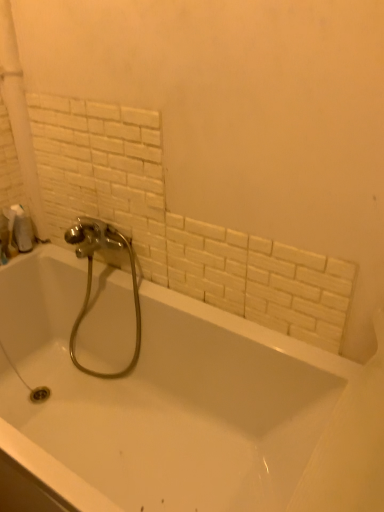
What do you see at coordinates (91, 278) in the screenshot?
I see `chrome metallic faucet at center` at bounding box center [91, 278].

In order to click on white glossy bathtub at center in this screenshot , I will do `click(158, 400)`.

From a real-world perspective, is white matte toilet paper at left located beneath chrome metallic faucet at center?

No, from a real-world perspective, white matte toilet paper at left is not below chrome metallic faucet at center.

How distant is white matte toilet paper at left from chrome metallic faucet at center?

white matte toilet paper at left and chrome metallic faucet at center are 13.01 inches apart.

From the image's perspective, is white matte toilet paper at left beneath chrome metallic faucet at center?

No, from the image's perspective, white matte toilet paper at left is not beneath chrome metallic faucet at center.

Which object is thinner, white matte toilet paper at left or chrome metallic faucet at center?

Thinner between the two is white matte toilet paper at left.

Is white matte toilet paper at left to the left of white glossy bathtub at center from the viewer's perspective?

Indeed, white matte toilet paper at left is positioned on the left side of white glossy bathtub at center.

Is point (21, 232) less distant than point (159, 485)?

No, (21, 232) is further to viewer.

Considering the sizes of objects white matte toilet paper at left and white glossy bathtub at center in the image provided, who is wider, white matte toilet paper at left or white glossy bathtub at center?

white glossy bathtub at center.

From the image's perspective, relative to white glossy bathtub at center, is white matte toilet paper at left above or below?

white matte toilet paper at left is above white glossy bathtub at center.

Is chrome metallic faucet at center positioned with its back to white glossy bathtub at center?

Yes, chrome metallic faucet at center is positioned with its back facing white glossy bathtub at center.

Is chrome metallic faucet at center shorter than white glossy bathtub at center?

In fact, chrome metallic faucet at center may be taller than white glossy bathtub at center.

Which object is positioned more to the left, chrome metallic faucet at center or white glossy bathtub at center?

From the viewer's perspective, chrome metallic faucet at center appears more on the left side.

Considering the sizes of chrome metallic faucet at center and white glossy bathtub at center in the image, is chrome metallic faucet at center bigger or smaller than white glossy bathtub at center?

Considering their sizes, chrome metallic faucet at center takes up less space than white glossy bathtub at center.

Between white glossy bathtub at center and chrome metallic faucet at center, which one is positioned in front?

Positioned in front is white glossy bathtub at center.

Choose the correct answer: Is white glossy bathtub at center inside chrome metallic faucet at center or outside it?

white glossy bathtub at center is spatially situated outside chrome metallic faucet at center.

Identify the location of bathtub in front of the chrome metallic faucet at center. (158, 400).

How many degrees apart are the facing directions of white glossy bathtub at center and chrome metallic faucet at center?

white glossy bathtub at center and chrome metallic faucet at center are facing 0.000261 degrees away from each other.

Are white glossy bathtub at center and white matte toilet paper at left far apart?

white glossy bathtub at center is near white matte toilet paper at left, not far away.

From the image's perspective, is white glossy bathtub at center located beneath white matte toilet paper at left?

Yes, from the image's perspective, white glossy bathtub at center is beneath white matte toilet paper at left.

Does point (220, 374) lie in front of point (15, 234)?

Yes, point (220, 374) is in front of point (15, 234).

Looking at their sizes, would you say chrome metallic faucet at center is wider or thinner than white matte toilet paper at left?

In the image, chrome metallic faucet at center appears to be wider than white matte toilet paper at left.

The image size is (384, 512). I want to click on tap in front of the white matte toilet paper at left, so click(91, 278).

Which is more to the left, chrome metallic faucet at center or white matte toilet paper at left?

From the viewer's perspective, white matte toilet paper at left appears more on the left side.

Identify the location of tap below the white matte toilet paper at left (from the image's perspective). This screenshot has height=512, width=384. (91, 278).

Where is `bathtub below the white matte toilet paper at left (from a real-world perspective)`? bathtub below the white matte toilet paper at left (from a real-world perspective) is located at coordinates (158, 400).

Which object lies further to the anchor point white matte toilet paper at left, white glossy bathtub at center or chrome metallic faucet at center?

white glossy bathtub at center lies further to white matte toilet paper at left than the other object.

Based on their spatial positions, is chrome metallic faucet at center or white matte toilet paper at left closer to white glossy bathtub at center?

Based on the image, chrome metallic faucet at center appears to be nearer to white glossy bathtub at center.

Looking at the image, which one is located closer to white matte toilet paper at left, chrome metallic faucet at center or white glossy bathtub at center?

Based on the image, chrome metallic faucet at center appears to be nearer to white matte toilet paper at left.

From the image, which object appears to be nearer to white glossy bathtub at center, white matte toilet paper at left or chrome metallic faucet at center?

chrome metallic faucet at center is positioned closer to the anchor white glossy bathtub at center.

Estimate the real-world distances between objects in this image. Which object is further from chrome metallic faucet at center, white matte toilet paper at left or white glossy bathtub at center?

white matte toilet paper at left.

Which object lies nearer to the anchor point chrome metallic faucet at center, white glossy bathtub at center or white matte toilet paper at left?

Among the two, white glossy bathtub at center is located nearer to chrome metallic faucet at center.

What are the coordinates of `tap between white glossy bathtub at center and white matte toilet paper at left in the front-back direction` in the screenshot? It's located at (91, 278).